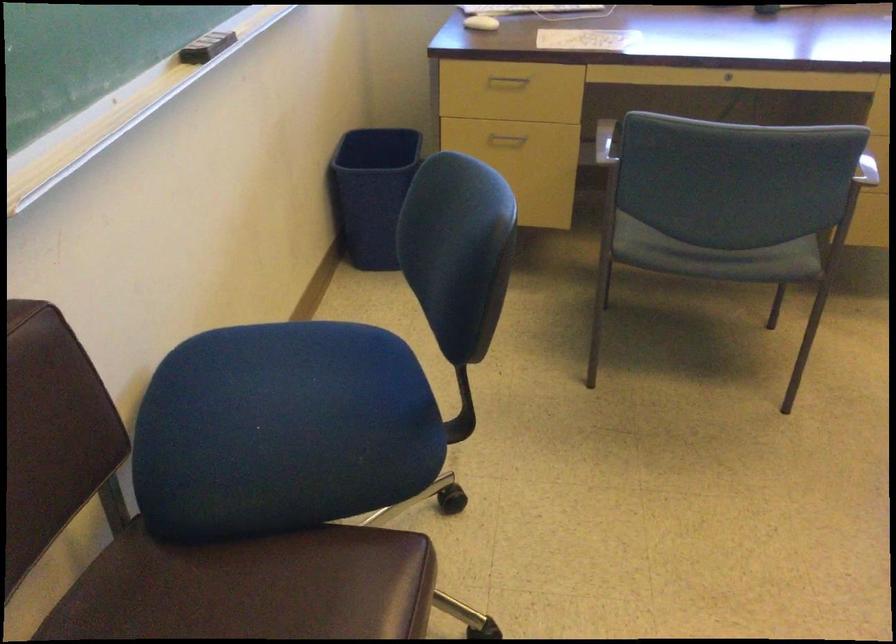
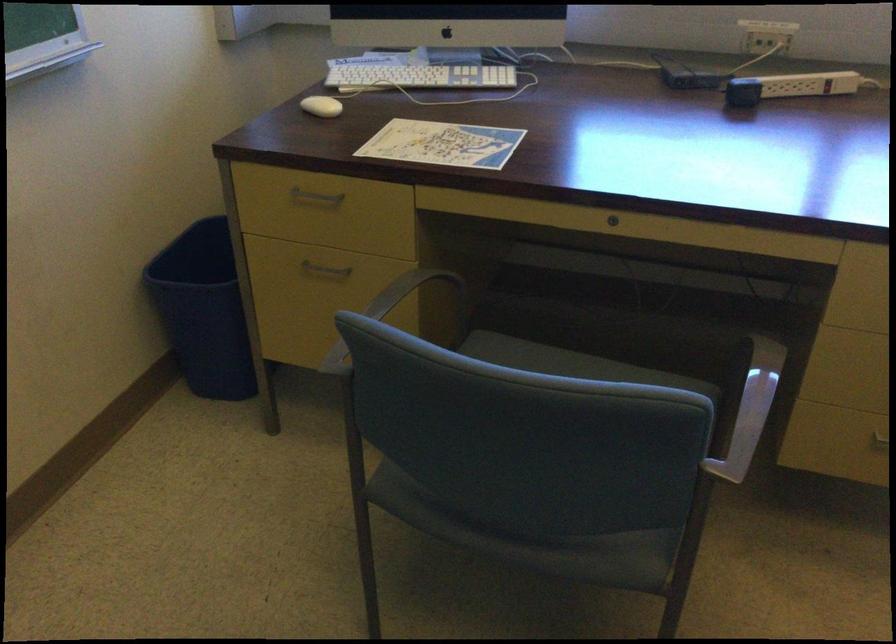
Find the pixel in the second image that matches pixel 556 162 in the first image.

(393, 308)